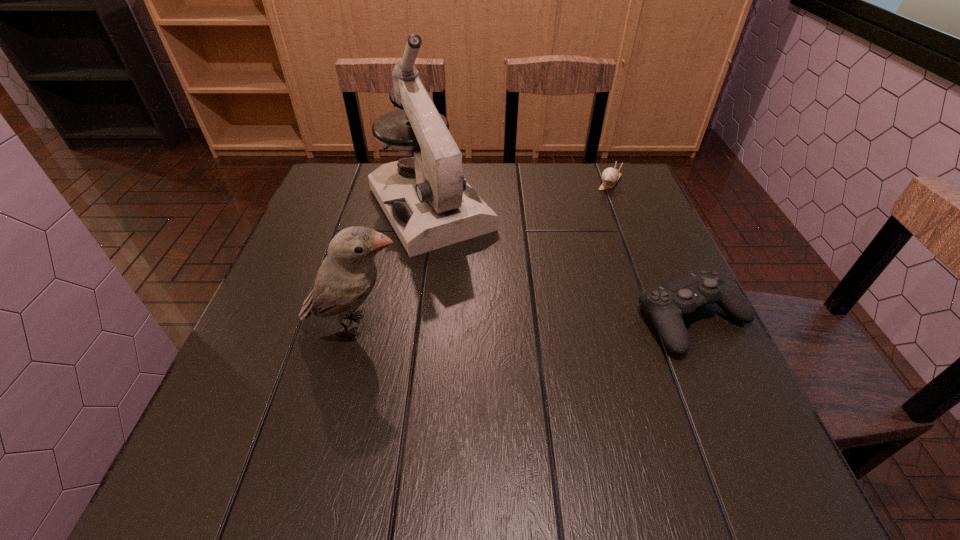
In the image, there is a desktop. Where is `vacant space at the far edge`? vacant space at the far edge is located at coordinates (571, 194).

You are a GUI agent. You are given a task and a screenshot of the screen. Output one action in this format:
    pyautogui.click(x=<x>, y=<y>)
    Task: Click on the free space at the near edge of the desktop
    
    Given the screenshot: What is the action you would take?
    pyautogui.click(x=623, y=391)

The image size is (960, 540). Identify the location of vacant position at the left edge of the desktop. (298, 295).

The height and width of the screenshot is (540, 960). In order to click on free region at the right edge in this screenshot , I will do `click(638, 289)`.

Locate an element on the screen. The width and height of the screenshot is (960, 540). blank area at the far left corner is located at coordinates (335, 178).

You are a GUI agent. You are given a task and a screenshot of the screen. Output one action in this format:
    pyautogui.click(x=<x>, y=<y>)
    Task: Click on the vacant area at the far right corner of the desktop
    
    Given the screenshot: What is the action you would take?
    pyautogui.click(x=594, y=186)

At what (x,y) coordinates should I click in order to perform the action: click on vacant area that lies between the third tallest object and the escargot. Please return your answer as a coordinate pair (x, y). The image size is (960, 540). Looking at the image, I should click on (652, 250).

Where is `vacant area that lies between the bird and the third tallest object`? Image resolution: width=960 pixels, height=540 pixels. vacant area that lies between the bird and the third tallest object is located at coordinates (524, 322).

Locate an element on the screen. unoccupied area between the control and the third shortest object is located at coordinates (524, 322).

The image size is (960, 540). In order to click on free spot between the escargot and the microscope in this screenshot , I will do `click(520, 195)`.